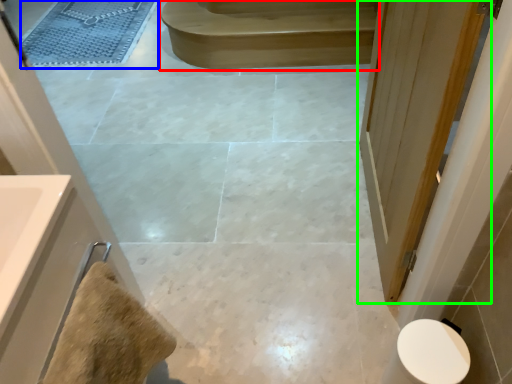
Question: Based on their relative distances, which object is nearer to stair (highlighted by a red box)? Choose from bath mat (highlighted by a blue box) and door (highlighted by a green box).

Choices:
 (A) bath mat
 (B) door

Answer: (A)